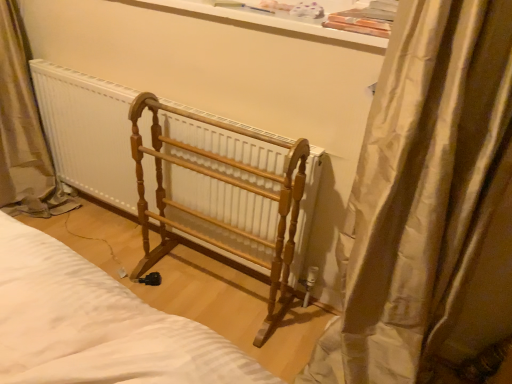
Question: From a real-world perspective, is white glossy window sill at upper center under wooden radiator at center?

Choices:
 (A) no
 (B) yes

Answer: (A)

Question: Does white glossy window sill at upper center appear on the left side of wooden radiator at center?

Choices:
 (A) yes
 (B) no

Answer: (B)

Question: Is white glossy window sill at upper center further to camera compared to wooden radiator at center?

Choices:
 (A) yes
 (B) no

Answer: (B)

Question: From the image's perspective, does white glossy window sill at upper center appear higher than wooden radiator at center?

Choices:
 (A) yes
 (B) no

Answer: (A)

Question: From a real-world perspective, is white glossy window sill at upper center on wooden radiator at center?

Choices:
 (A) no
 (B) yes

Answer: (B)

Question: Looking at the image, does silky beige curtain at right seem bigger or smaller compared to wooden radiator at center?

Choices:
 (A) big
 (B) small

Answer: (A)

Question: Considering their positions, is silky beige curtain at right located in front of or behind wooden radiator at center?

Choices:
 (A) behind
 (B) front

Answer: (B)

Question: From a real-world perspective, is silky beige curtain at right positioned above or below wooden radiator at center?

Choices:
 (A) below
 (B) above

Answer: (B)

Question: Is silky beige curtain at right inside or outside of wooden radiator at center?

Choices:
 (A) outside
 (B) inside

Answer: (A)

Question: From the image's perspective, is wooden radiator at center above or below light brown wood rack at center?

Choices:
 (A) above
 (B) below

Answer: (A)

Question: From their relative heights in the image, would you say wooden radiator at center is taller or shorter than light brown wood rack at center?

Choices:
 (A) tall
 (B) short

Answer: (B)

Question: Which is correct: wooden radiator at center is inside light brown wood rack at center, or outside of it?

Choices:
 (A) outside
 (B) inside

Answer: (A)

Question: In the image, is wooden radiator at center positioned in front of or behind light brown wood rack at center?

Choices:
 (A) front
 (B) behind

Answer: (B)

Question: Considering the positions of wooden radiator at center and white glossy window sill at upper center in the image, is wooden radiator at center taller or shorter than white glossy window sill at upper center?

Choices:
 (A) short
 (B) tall

Answer: (B)

Question: In terms of width, does wooden radiator at center look wider or thinner when compared to white glossy window sill at upper center?

Choices:
 (A) wide
 (B) thin

Answer: (B)